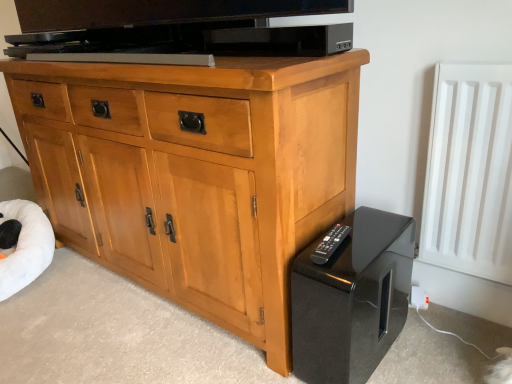
Find the location of a particular element. vacant space that is in between light wood cabinet at center and white plush bean bag at lower left is located at coordinates (100, 320).